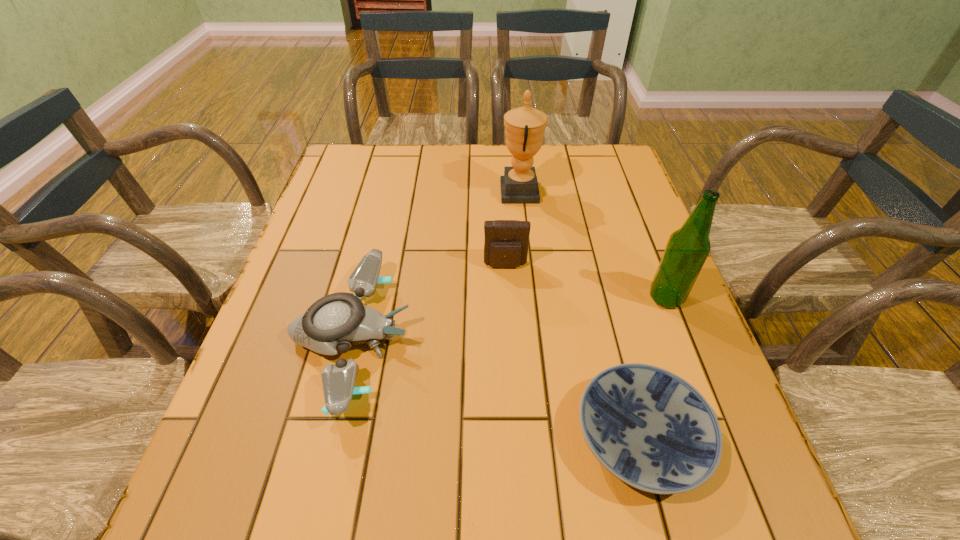
This screenshot has height=540, width=960. I want to click on vacant space located on the label of the beer bottle, so click(556, 298).

This screenshot has width=960, height=540. What are the coordinates of `vacant space located on the label of the beer bottle` in the screenshot? It's located at (525, 298).

I want to click on blank space located 0.210m with an open flap on the third shortest object, so click(510, 343).

At what (x,y) coordinates should I click in order to perform the action: click on vacant space located on the front-facing side of the leftmost object. Please return your answer as a coordinate pair (x, y). Looking at the image, I should click on (529, 337).

The height and width of the screenshot is (540, 960). I want to click on vacant space located 0.050m on the back of the plate, so click(619, 357).

At what (x,y) coordinates should I click in order to perform the action: click on object positioned at the far edge. Please return your answer as a coordinate pair (x, y). This screenshot has height=540, width=960. Looking at the image, I should click on (525, 126).

Locate an element on the screen. This screenshot has height=540, width=960. object that is at the near edge is located at coordinates (653, 430).

Where is `object that is at the left edge`? This screenshot has width=960, height=540. object that is at the left edge is located at coordinates (333, 323).

At what (x,y) coordinates should I click in order to perform the action: click on beer bottle located in the right edge section of the desktop. Please return your answer as a coordinate pair (x, y). Image resolution: width=960 pixels, height=540 pixels. Looking at the image, I should click on (687, 249).

Image resolution: width=960 pixels, height=540 pixels. What are the coordinates of `plate located in the right edge section of the desktop` in the screenshot? It's located at (653, 430).